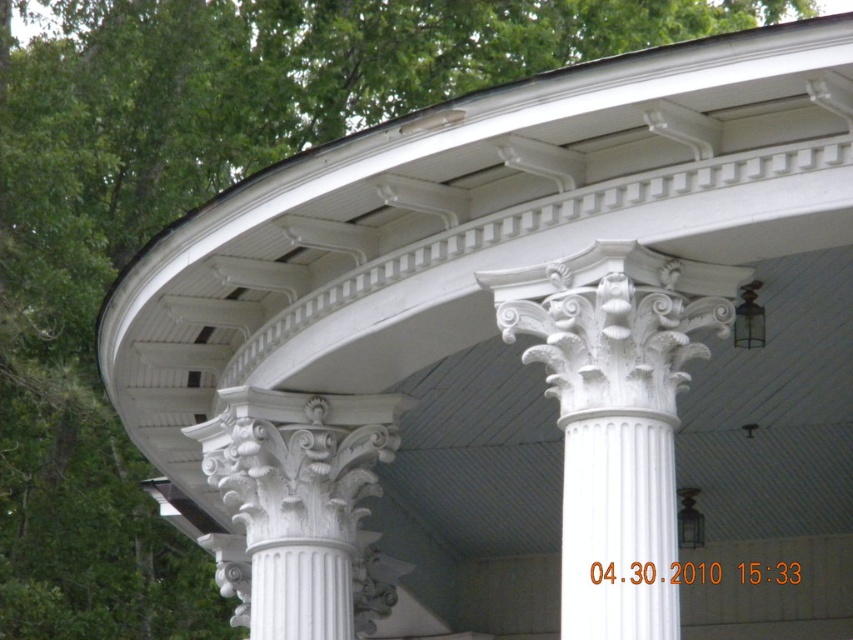
Does white marble column at center appear on the left side of white textured column at center?

In fact, white marble column at center is to the right of white textured column at center.

Can you confirm if white marble column at center is positioned above white textured column at center?

Yes, white marble column at center is above white textured column at center.

Is point (628, 605) farther from camera compared to point (254, 509)?

No, (628, 605) is in front of (254, 509).

Where is `white marble column at center`? The height and width of the screenshot is (640, 853). white marble column at center is located at coordinates coord(616,417).